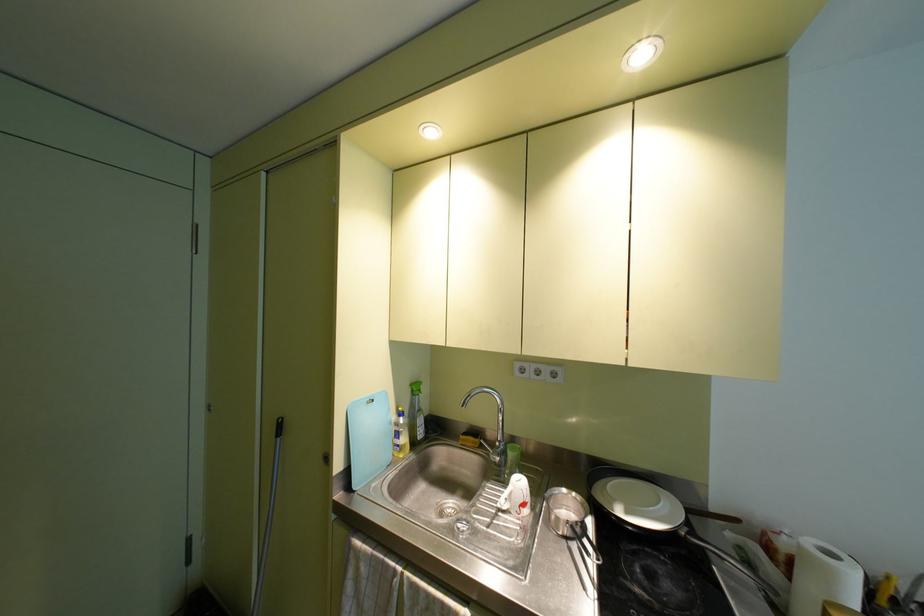
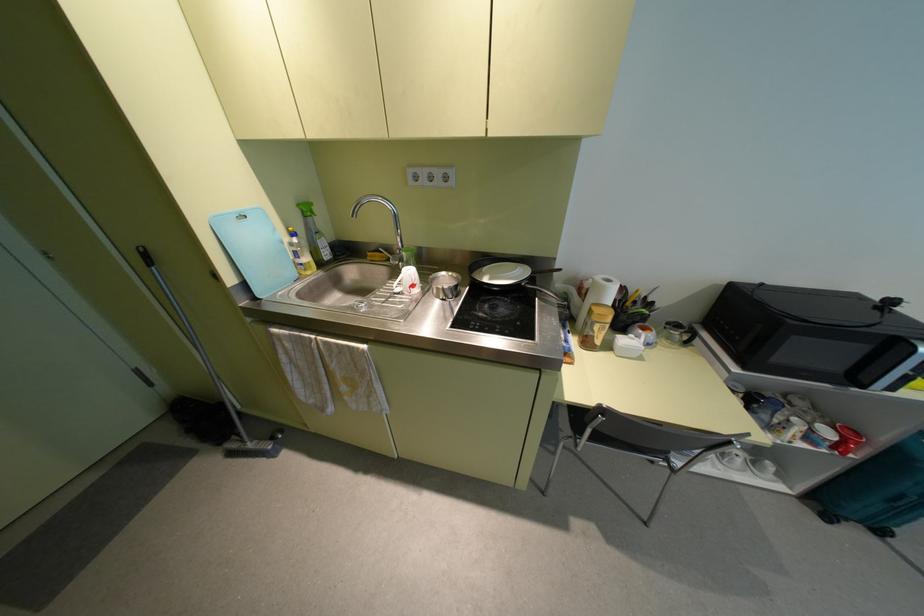
Find the pixel in the second image that matches point (807, 541) in the first image.

(599, 277)